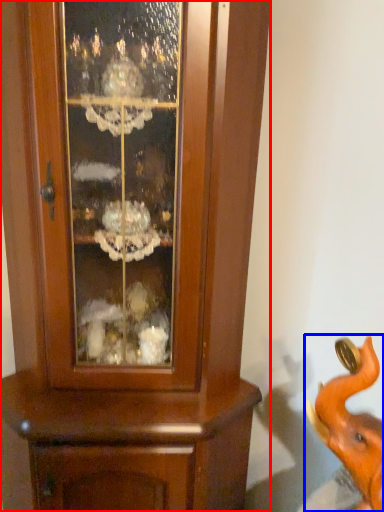
Question: Which of the following is the farthest to the observer, cupboard (highlighted by a red box) or elephant (highlighted by a blue box)?

Choices:
 (A) cupboard
 (B) elephant

Answer: (A)